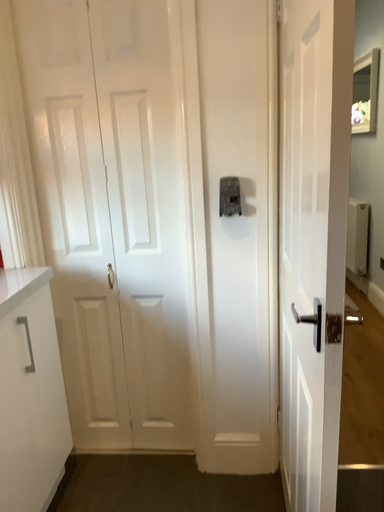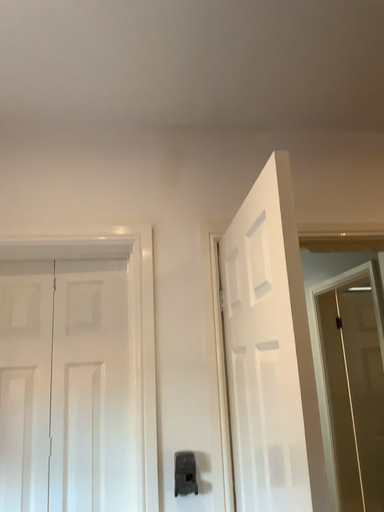
Question: How did the camera likely rotate when shooting the video?

Choices:
 (A) rotated right
 (B) rotated left

Answer: (A)